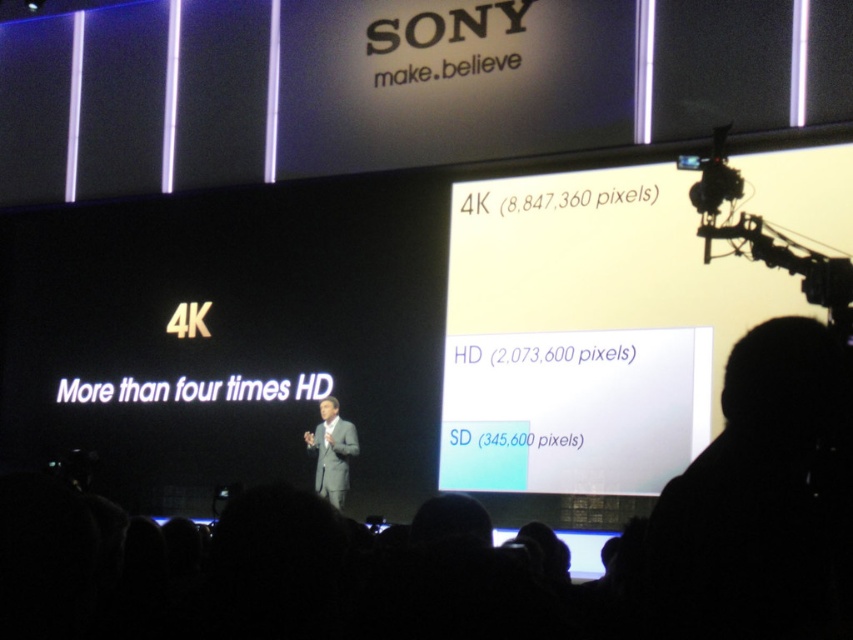
Question: Which point is closer to the camera?

Choices:
 (A) (813, 259)
 (B) (345, 420)

Answer: (A)

Question: Among these points, which one is farthest from the camera?

Choices:
 (A) (820, 259)
 (B) (345, 461)

Answer: (B)

Question: Does black metal video camera at upper right appear under gray suit at center?

Choices:
 (A) no
 (B) yes

Answer: (A)

Question: Is black metal video camera at upper right positioned behind gray suit at center?

Choices:
 (A) no
 (B) yes

Answer: (A)

Question: Does black metal video camera at upper right have a lesser width compared to gray suit at center?

Choices:
 (A) yes
 (B) no

Answer: (B)